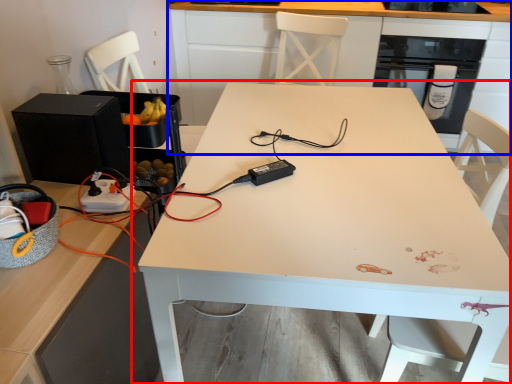
Question: Which object appears farthest to the camera in this image, table (highlighted by a red box) or cabinetry (highlighted by a blue box)?

Choices:
 (A) table
 (B) cabinetry

Answer: (B)